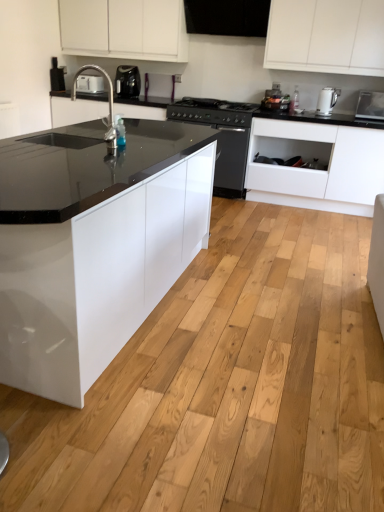
Question: From a real-world perspective, is white plastic toaster at upper left, marked as the 2th appliance in a right-to-left arrangement, over black plastic coffee maker at upper center, the second kitchen appliance when ordered from right to left?

Choices:
 (A) yes
 (B) no

Answer: (B)

Question: Is white plastic toaster at upper left, which is counted as the 1th appliance, starting from the top, outside black plastic coffee maker at upper center, the first kitchen appliance when ordered from top to bottom?

Choices:
 (A) yes
 (B) no

Answer: (A)

Question: Can you confirm if white plastic toaster at upper left, which is counted as the 1th appliance, starting from the top, is thinner than black plastic coffee maker at upper center, the second kitchen appliance when ordered from bottom to top?

Choices:
 (A) no
 (B) yes

Answer: (B)

Question: Would you say white plastic toaster at upper left, marked as the 2th appliance in a right-to-left arrangement, is a long distance from black plastic coffee maker at upper center, which is counted as the first kitchen appliance, starting from the back?

Choices:
 (A) no
 (B) yes

Answer: (A)

Question: Considering the relative positions of white plastic toaster at upper left, which is counted as the 1th appliance, starting from the top, and black plastic coffee maker at upper center, the second kitchen appliance when ordered from right to left, in the image provided, is white plastic toaster at upper left, which is counted as the 1th appliance, starting from the top, to the left of black plastic coffee maker at upper center, the second kitchen appliance when ordered from right to left, from the viewer's perspective?

Choices:
 (A) yes
 (B) no

Answer: (A)

Question: Can you confirm if white plastic toaster at upper left, which is the second appliance in bottom-to-top order, is bigger than black plastic coffee maker at upper center, marked as the first kitchen appliance in a left-to-right arrangement?

Choices:
 (A) no
 (B) yes

Answer: (A)

Question: Is black matte stove at center in contact with white matte cabinet at center, which appears as the 1th cabinetry when ordered from the bottom?

Choices:
 (A) no
 (B) yes

Answer: (A)

Question: Is black matte stove at center far away from white matte cabinet at center, which appears as the 1th cabinetry when ordered from the bottom?

Choices:
 (A) yes
 (B) no

Answer: (B)

Question: Is black matte stove at center thinner than white matte cabinet at center, which appears as the 1th cabinetry when ordered from the bottom?

Choices:
 (A) no
 (B) yes

Answer: (A)

Question: Considering the relative positions of black matte stove at center and white matte cabinet at center, which appears as the 1th cabinetry when ordered from the bottom, in the image provided, is black matte stove at center to the left of white matte cabinet at center, which appears as the 1th cabinetry when ordered from the bottom, from the viewer's perspective?

Choices:
 (A) no
 (B) yes

Answer: (B)

Question: From a real-world perspective, is black matte stove at center physically above white matte cabinet at center, which is the first cabinetry in right-to-left order?

Choices:
 (A) no
 (B) yes

Answer: (B)

Question: Is black matte stove at center not within white matte cabinet at center, the 2th cabinetry in the left-to-right sequence?

Choices:
 (A) no
 (B) yes

Answer: (B)

Question: From the image's perspective, is white glossy electric kettle at upper right, which is the second kitchen appliance in top-to-bottom order, above transparent plastic bottle at center?

Choices:
 (A) yes
 (B) no

Answer: (B)